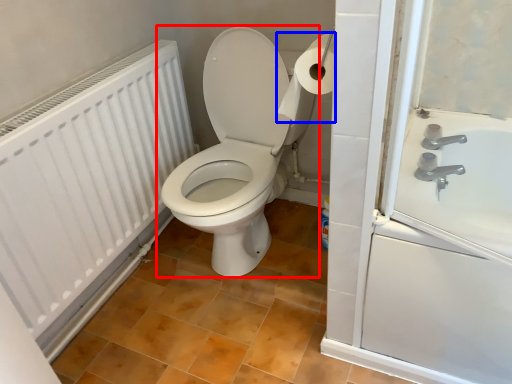
Question: Among these objects, which one is farthest to the camera, toilet (highlighted by a red box) or toilet paper (highlighted by a blue box)?

Choices:
 (A) toilet
 (B) toilet paper

Answer: (A)